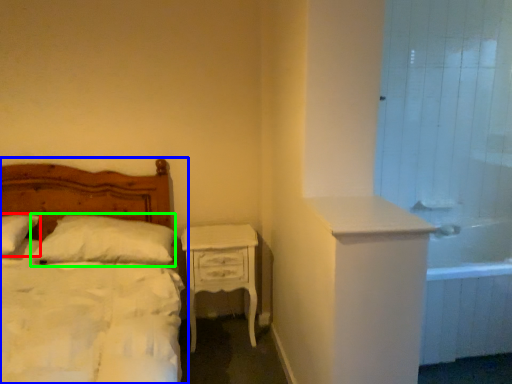
Question: Considering the real-world distances, which object is closest to pillow (highlighted by a red box)? bed (highlighted by a blue box) or pillow (highlighted by a green box).

Choices:
 (A) bed
 (B) pillow

Answer: (B)